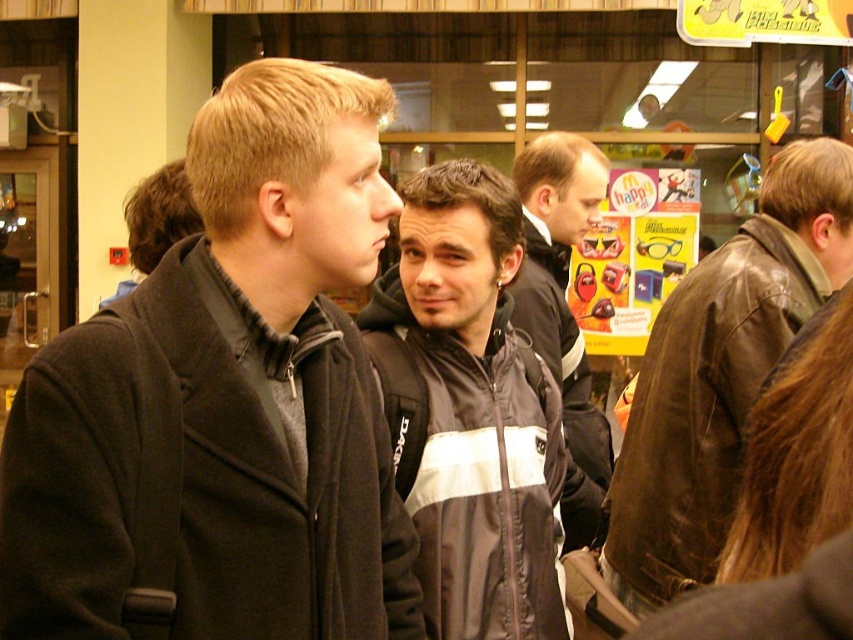
Based on the scene description, where is the black and white nylon jacket at center located in terms of coordinates?

The black and white nylon jacket at center is located at coordinates point (473, 468).

You are a tailor who needs to determine which jacket requires more fabric to make between the dark gray woolen jacket at center and the black and white nylon jacket at center. Based on the jackets in the image, which one would need more fabric?

The dark gray woolen jacket at center requires more fabric because its width is larger than the black and white nylon jacket at center.

You are a store manager trying to arrange two jackets for display. You have a black and white nylon jacket at center and a dark gray jacket at center. Which jacket should you choose to place on a narrow display stand that can only accommodate a jacket with a maximum width of 30 cm?

The dark gray jacket at center should be placed on the narrow display stand since the black and white nylon jacket at center might be wider than the dark gray jacket at center, exceeding the 30 cm width limit.